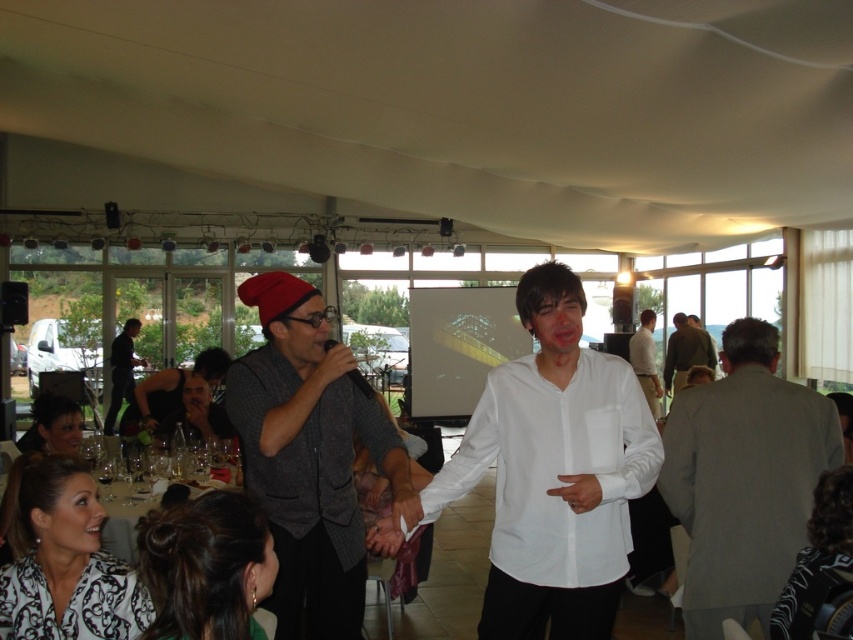
You are a photographer at the event and need to capture a photo of both the white smooth shirt at center and the dark brown hair at lower left in the same frame. The camera has a focal length of 50mm. Considering the distance between them, is it possible to include both subjects in the photo without moving the camera?

The white smooth shirt at center is 31.73 inches from the dark brown hair at lower left. With a 50mm focal length, which provides a moderate field of view, it is feasible to capture both subjects in the same frame without moving the camera, as the distance between them is within the camera lens range.

In the scene, there is a point labeled as point (207,566). What object does this point correspond to?

The point (207,566) corresponds to the dark brown hair at lower left.